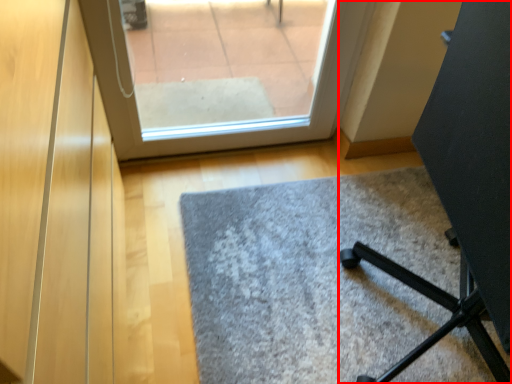
Question: From the image's perspective, considering the relative positions of furniture (annotated by the red box) and door in the image provided, where is furniture (annotated by the red box) located with respect to the staircase?

Choices:
 (A) above
 (B) below

Answer: (A)